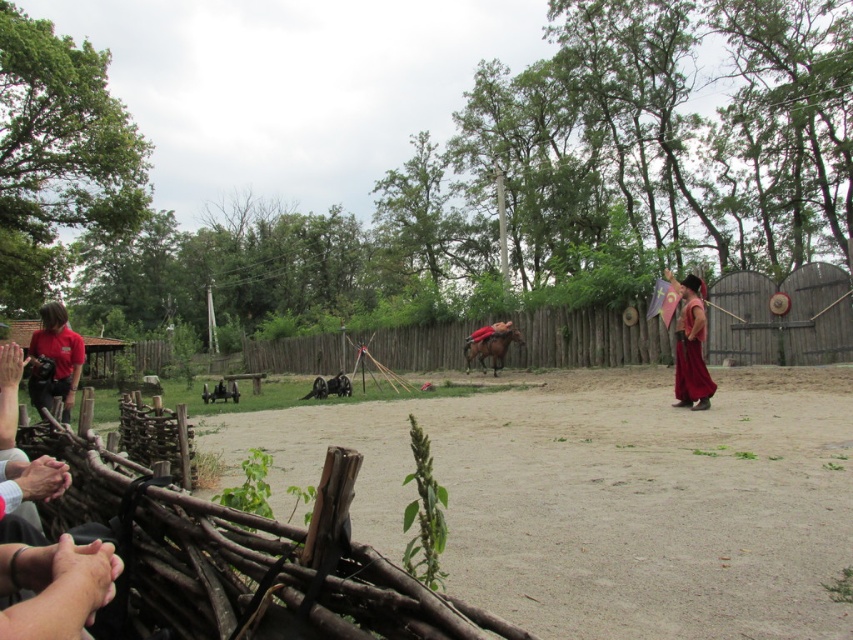
Question: Is brown sandy ground at center thinner than velvet maroon robe at right?

Choices:
 (A) yes
 (B) no

Answer: (B)

Question: Observing the image, what is the correct spatial positioning of matte red shirt at left in reference to brown glossy horse at center?

Choices:
 (A) right
 (B) left

Answer: (B)

Question: Estimate the real-world distances between objects in this image. Which object is closer to the velvet maroon robe at right?

Choices:
 (A) matte red shirt at left
 (B) brown glossy horse at center

Answer: (A)

Question: Is matte red shirt at left positioned in front of velvet maroon robe at right?

Choices:
 (A) yes
 (B) no

Answer: (A)

Question: Which point is farther from the camera taking this photo?

Choices:
 (A) (483, 358)
 (B) (549, 412)
 (C) (57, 330)

Answer: (A)

Question: Among these points, which one is nearest to the camera?

Choices:
 (A) (730, 404)
 (B) (502, 349)

Answer: (A)